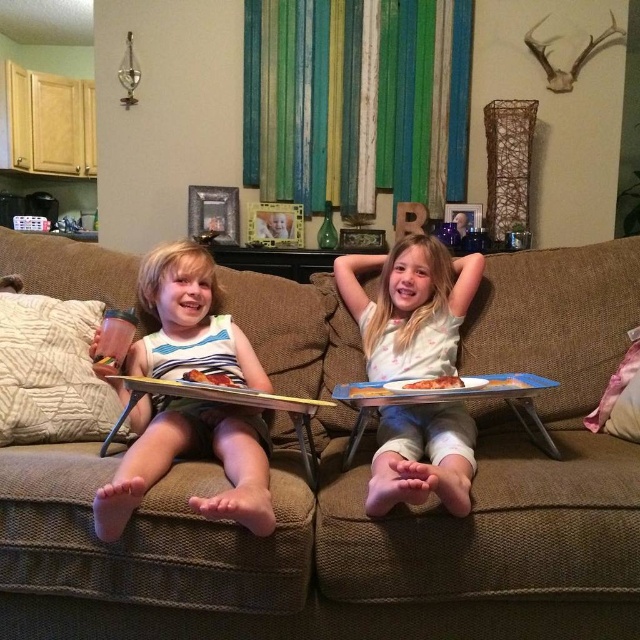
Can you confirm if brown fabric couch at center is smaller than white cotton shirt at center?

Incorrect, brown fabric couch at center is not smaller in size than white cotton shirt at center.

Is brown fabric couch at center positioned behind white cotton shirt at center?

Yes, brown fabric couch at center is further from the viewer.

From the picture: Measure the distance between point [54,499] and camera.

Point [54,499] is 1.16 meters from camera.

You are a GUI agent. You are given a task and a screenshot of the screen. Output one action in this format:
    pyautogui.click(x=<x>, y=<y>)
    Task: Click on the brown fabric couch at center
    This screenshot has height=640, width=640.
    Given the screenshot: What is the action you would take?
    pyautogui.click(x=362, y=508)

Does brown fabric couch at center have a greater height compared to wooden tray at left?

Indeed, brown fabric couch at center has a greater height compared to wooden tray at left.

Can you confirm if brown fabric couch at center is bigger than wooden tray at left?

Yes, brown fabric couch at center is bigger than wooden tray at left.

Who is more distant from viewer, (506, 529) or (257, 403)?

Positioned behind is point (257, 403).

You are a GUI agent. You are given a task and a screenshot of the screen. Output one action in this format:
    pyautogui.click(x=<x>, y=<y>)
    Task: Click on the brown fabric couch at center
    Image resolution: width=640 pixels, height=640 pixels.
    Given the screenshot: What is the action you would take?
    pyautogui.click(x=362, y=508)

Can you confirm if white cotton shirt at center is smaller than wooden tray at left?

No.

Describe the element at coordinates (410, 307) in the screenshot. I see `white cotton shirt at center` at that location.

You are a GUI agent. You are given a task and a screenshot of the screen. Output one action in this format:
    pyautogui.click(x=<x>, y=<y>)
    Task: Click on the white cotton shirt at center
    
    Given the screenshot: What is the action you would take?
    pyautogui.click(x=410, y=307)